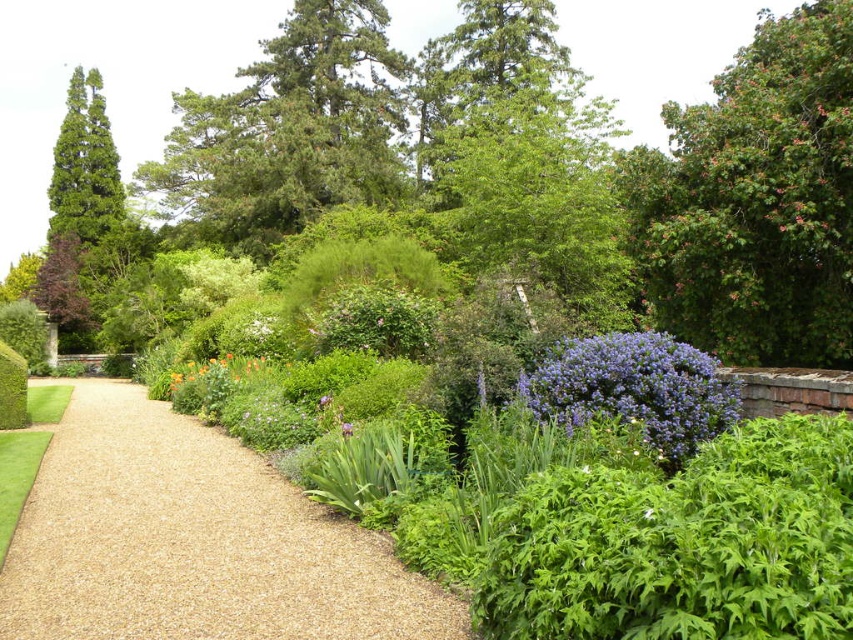
Between brown gravel path at center and purple matte flower at center, which one is positioned lower?

brown gravel path at center

Is point (251, 468) positioned behind point (352, 426)?

Yes, point (251, 468) is farther from viewer.

The width and height of the screenshot is (853, 640). I want to click on brown gravel path at center, so click(193, 541).

Who is more distant from viewer, (218, 381) or (343, 422)?

Positioned behind is point (218, 381).

Does orange matte flower at center lie behind purple matte flower at center?

That is True.

This screenshot has height=640, width=853. What do you see at coordinates (218, 372) in the screenshot?
I see `orange matte flower at center` at bounding box center [218, 372].

I want to click on orange matte flower at center, so pos(218,372).

Does purple matte bush at center-right have a greater width compared to orange matte flower at center?

Indeed, purple matte bush at center-right has a greater width compared to orange matte flower at center.

Can you confirm if purple matte bush at center-right is positioned to the right of orange matte flower at center?

Correct, you'll find purple matte bush at center-right to the right of orange matte flower at center.

This screenshot has width=853, height=640. In order to click on purple matte bush at center-right in this screenshot , I will do `click(636, 388)`.